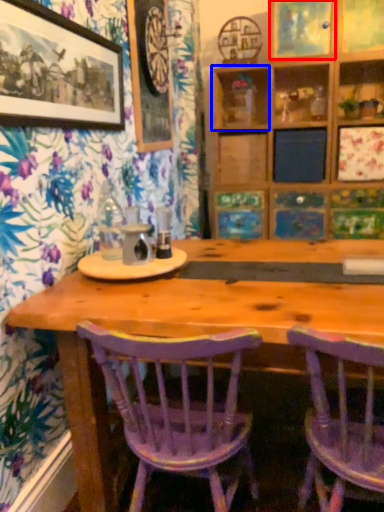
Question: Among these objects, which one is nearest to the camera, decorative picture (highlighted by a red box) or shelf (highlighted by a blue box)?

Choices:
 (A) decorative picture
 (B) shelf

Answer: (A)